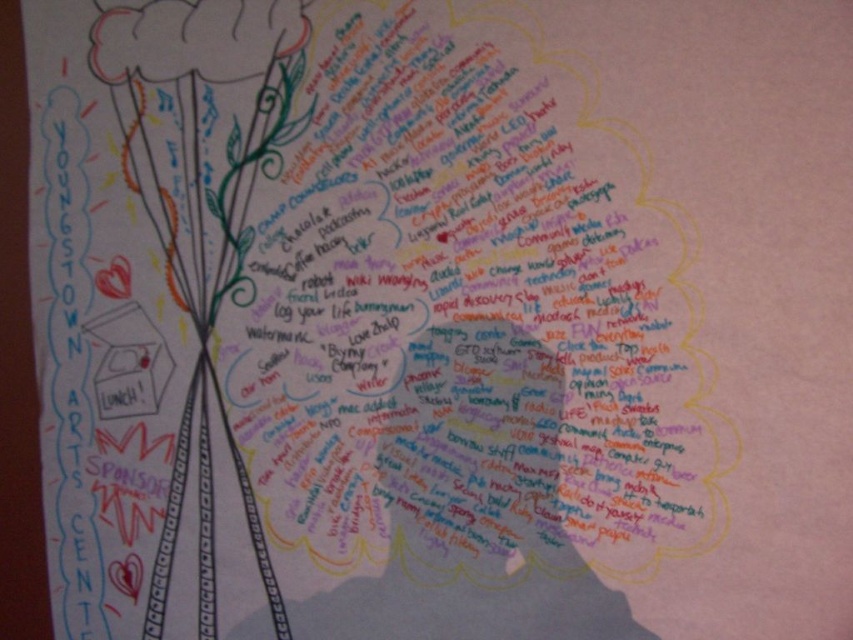
Question: Does green leafy tree at center have a lesser width compared to matte paper flower at upper left?

Choices:
 (A) yes
 (B) no

Answer: (A)

Question: Which point is farther to the camera?

Choices:
 (A) matte paper flower at upper left
 (B) green leafy tree at center

Answer: (B)

Question: Among these objects, which one is nearest to the camera?

Choices:
 (A) green leafy tree at center
 (B) matte paper flower at upper left

Answer: (B)

Question: Which point is farther from the camera taking this photo?

Choices:
 (A) (144, 42)
 (B) (160, 154)

Answer: (B)

Question: Is green leafy tree at center bigger than matte paper flower at upper left?

Choices:
 (A) no
 (B) yes

Answer: (B)

Question: Where is green leafy tree at center located in relation to matte paper flower at upper left in the image?

Choices:
 (A) left
 (B) right

Answer: (A)